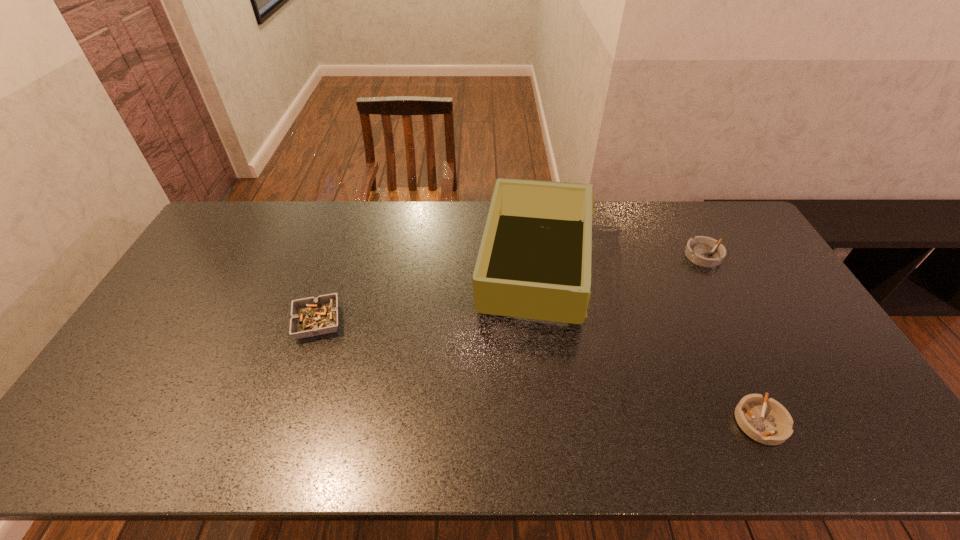
You are a GUI agent. You are given a task and a screenshot of the screen. Output one action in this format:
    pyautogui.click(x=<x>, y=<y>)
    Task: Click on the free space between the nearest object and the farthest ashtray
    
    Given the screenshot: What is the action you would take?
    pyautogui.click(x=732, y=339)

This screenshot has height=540, width=960. In order to click on free space between the nearest ashtray and the leftmost ashtray in this screenshot , I will do `click(539, 372)`.

Where is `unoccupied position between the leftmost object and the nearest object`? Image resolution: width=960 pixels, height=540 pixels. unoccupied position between the leftmost object and the nearest object is located at coordinates (539, 372).

Locate an element on the screen. The image size is (960, 540). free spot between the nearest object and the box is located at coordinates (647, 345).

You are a GUI agent. You are given a task and a screenshot of the screen. Output one action in this format:
    pyautogui.click(x=<x>, y=<y>)
    Task: Click on the free space between the third object from right to left and the nearest ashtray
    The width and height of the screenshot is (960, 540).
    Given the screenshot: What is the action you would take?
    pyautogui.click(x=647, y=345)

Find the location of a particular element. Image resolution: width=960 pixels, height=540 pixels. vacant area between the nearest ashtray and the farthest ashtray is located at coordinates (732, 339).

Find the location of a particular element. This screenshot has height=540, width=960. free space between the box and the farthest ashtray is located at coordinates (619, 262).

Where is `free space between the box and the nearest object`? The image size is (960, 540). free space between the box and the nearest object is located at coordinates 647,345.

The image size is (960, 540). In order to click on object that is the closest one to the farthest ashtray in this screenshot , I will do `click(534, 261)`.

Identify the location of the third closest object to the second farthest ashtray. The width and height of the screenshot is (960, 540). (704, 251).